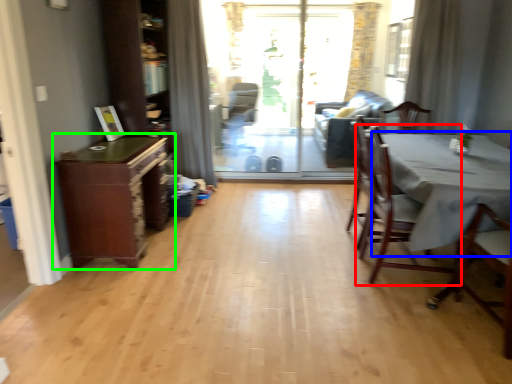
Question: Considering the real-world distances, which object is farthest from chair (highlighted by a red box)? table (highlighted by a blue box) or cabinetry (highlighted by a green box)?

Choices:
 (A) table
 (B) cabinetry

Answer: (B)